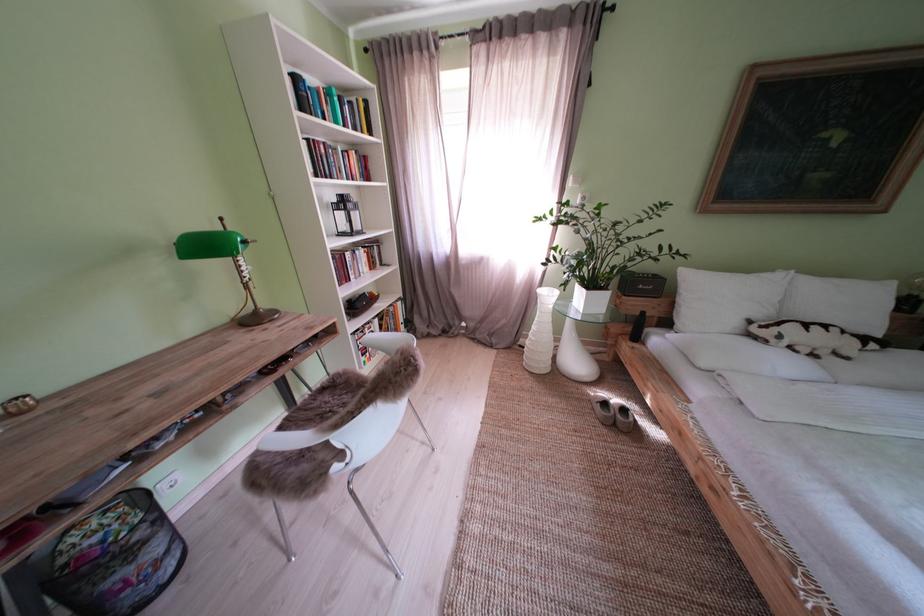
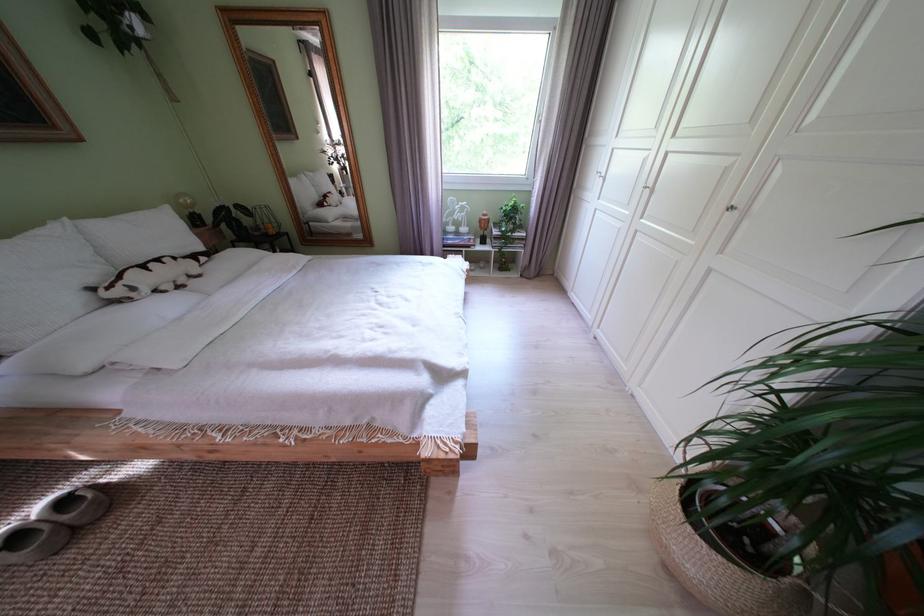
Locate, in the second image, the point that corresponds to the point at 792,342 in the first image.

(146, 294)